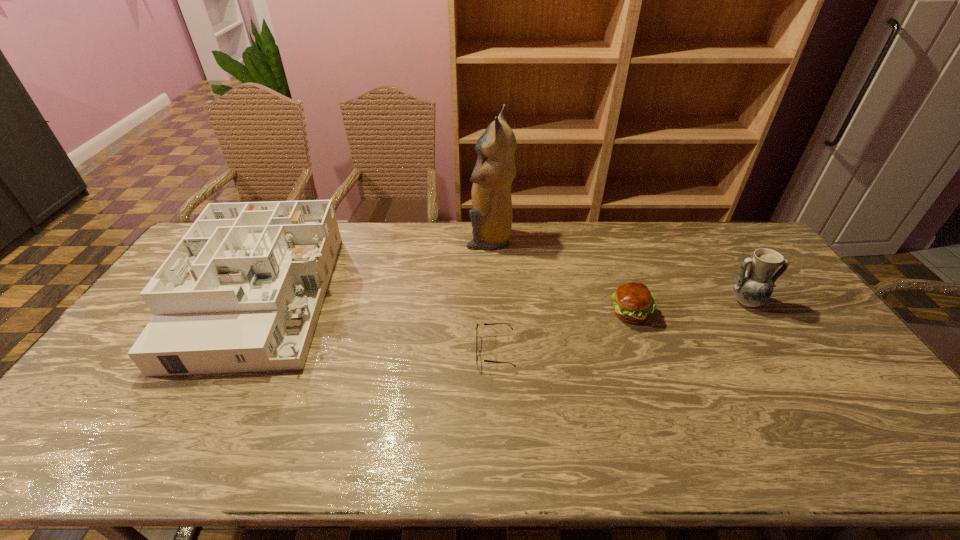
Find the location of a particular element. the tallest object is located at coordinates (491, 216).

You are a GUI agent. You are given a task and a screenshot of the screen. Output one action in this format:
    pyautogui.click(x=<x>, y=<y>)
    Task: Click on the pottery
    This screenshot has width=960, height=540.
    Given the screenshot: What is the action you would take?
    pyautogui.click(x=752, y=288)

Identify the location of dollhouse. Image resolution: width=960 pixels, height=540 pixels. (242, 291).

At what (x,y) coordinates should I click in order to perform the action: click on hamburger. Please return your answer as a coordinate pair (x, y). Looking at the image, I should click on (633, 302).

Where is `the second shortest object`? Image resolution: width=960 pixels, height=540 pixels. the second shortest object is located at coordinates (633, 302).

The height and width of the screenshot is (540, 960). What are the coordinates of `spectacles` in the screenshot? It's located at (483, 324).

Identify the location of vacant space located 0.060m on the face of the cat. (450, 239).

The width and height of the screenshot is (960, 540). Identify the location of free spot located on the face of the cat. (420, 239).

Locate an element on the screen. The image size is (960, 540). blank area located 0.400m on the face of the cat is located at coordinates (358, 239).

This screenshot has width=960, height=540. I want to click on free space located 0.050m on either side of the pottery, so click(760, 326).